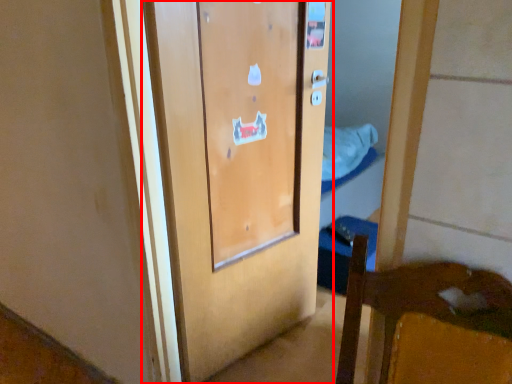
Question: Considering the relative positions of door (annotated by the red box) and sheet in the image provided, where is door (annotated by the red box) located with respect to the staircase?

Choices:
 (A) left
 (B) right

Answer: (A)